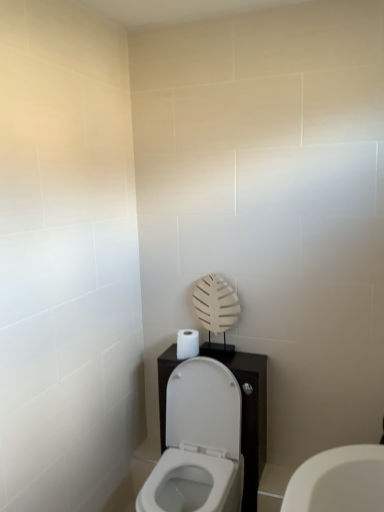
Question: Considering their positions, is white matte toilet paper at center located in front of or behind white glossy toilet at center?

Choices:
 (A) front
 (B) behind

Answer: (B)

Question: Considering the positions of white matte toilet paper at center and white glossy toilet at center in the image, is white matte toilet paper at center taller or shorter than white glossy toilet at center?

Choices:
 (A) tall
 (B) short

Answer: (B)

Question: Considering the positions of white matte toilet paper at center and white glossy toilet at center in the image, is white matte toilet paper at center bigger or smaller than white glossy toilet at center?

Choices:
 (A) big
 (B) small

Answer: (B)

Question: Is white glossy toilet at center bigger or smaller than white matte toilet paper at center?

Choices:
 (A) small
 (B) big

Answer: (B)

Question: From their relative heights in the image, would you say white glossy toilet at center is taller or shorter than white matte toilet paper at center?

Choices:
 (A) tall
 (B) short

Answer: (A)

Question: From the image's perspective, is white glossy toilet at center located above or below white matte toilet paper at center?

Choices:
 (A) above
 (B) below

Answer: (B)

Question: In terms of width, does white glossy toilet at center look wider or thinner when compared to white matte toilet paper at center?

Choices:
 (A) thin
 (B) wide

Answer: (B)